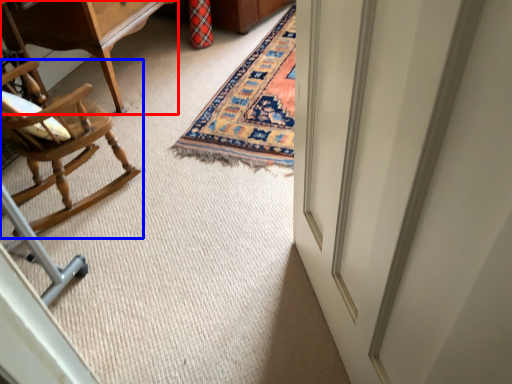
Question: Which point is further to the camera, table (highlighted by a red box) or chair (highlighted by a blue box)?

Choices:
 (A) table
 (B) chair

Answer: (A)